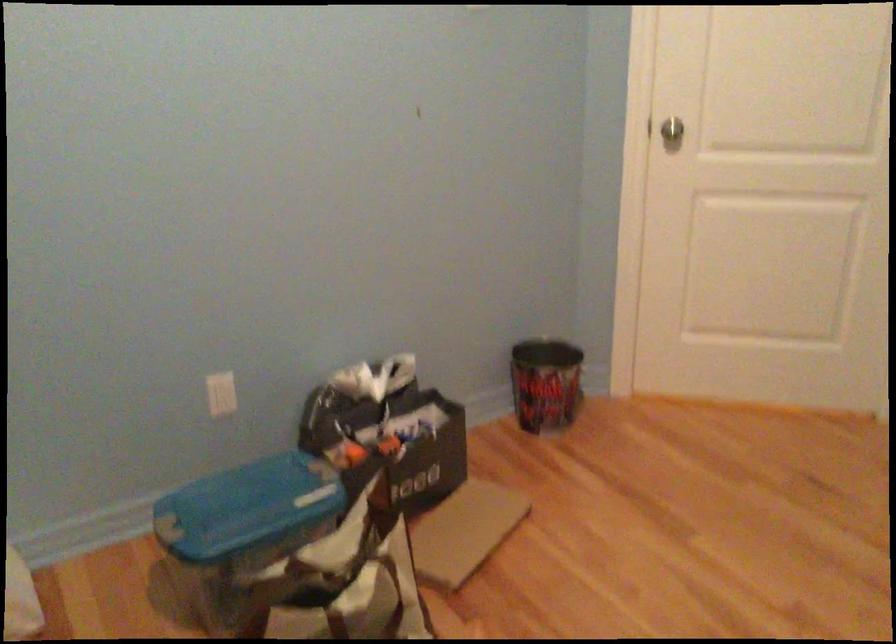
This screenshot has width=896, height=644. What do you see at coordinates (667, 128) in the screenshot?
I see `a silver door knob` at bounding box center [667, 128].